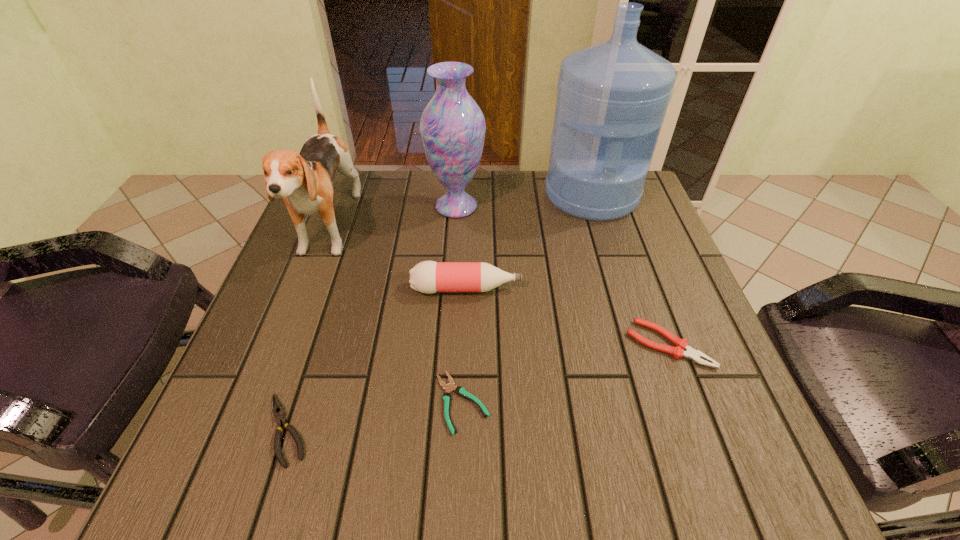
Find the location of a particular element. The image size is (960, 540). the tallest object is located at coordinates (612, 97).

Locate an element on the screen. vase is located at coordinates (452, 126).

The height and width of the screenshot is (540, 960). I want to click on puppy, so click(304, 180).

The width and height of the screenshot is (960, 540). Find the location of `bottle`. bottle is located at coordinates point(428,277).

I want to click on the farthest pliers, so click(696, 356).

The image size is (960, 540). I want to click on the third shortest object, so click(x=696, y=356).

The image size is (960, 540). In order to click on the leftmost pliers in this screenshot , I will do `click(278, 411)`.

Where is `the second shortest object`? The height and width of the screenshot is (540, 960). the second shortest object is located at coordinates (278, 411).

This screenshot has height=540, width=960. In order to click on the shortest object in this screenshot , I will do `click(450, 387)`.

Locate an element on the screen. the second pliers from right to left is located at coordinates click(x=450, y=387).